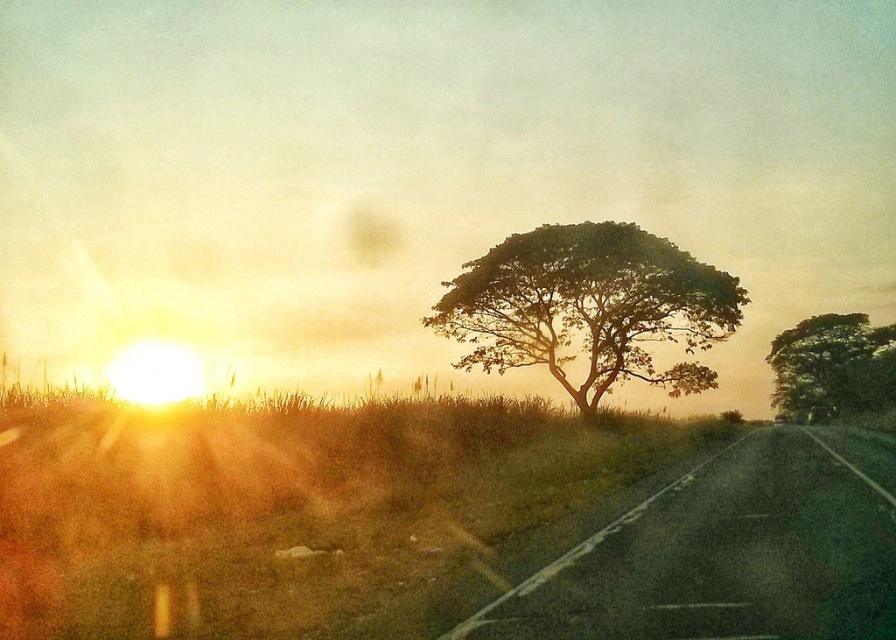
You are standing at the starting point of the road and want to walk towards the green leafy tree at center. Which direction should you head?

The green leafy tree at center is located at point (589, 307), so you should head towards the center of the image to reach it.

In the scene shown: You are standing at the starting point of the road in the rural scene. You notice two points marked on the image. Which point, point (712, 465) or point (793, 406), is closer to you?

Point (712, 465) is closer to the viewer than point (793, 406).